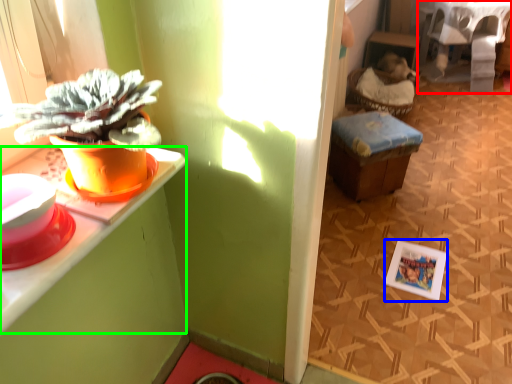
Question: Which object is the farthest from table (highlighted by a red box)? Choose among these: picture frame (highlighted by a blue box) or desk (highlighted by a green box).

Choices:
 (A) picture frame
 (B) desk

Answer: (B)